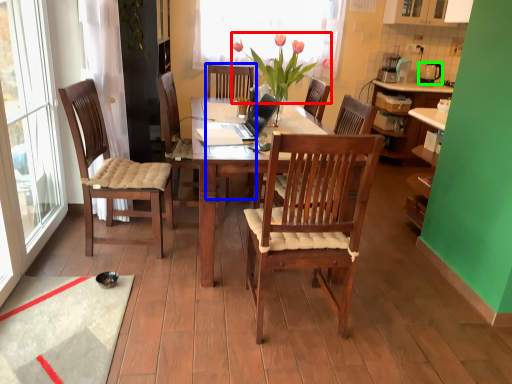
Question: Which object is positioned farthest from flower (highlighted by a red box)? Select from armchair (highlighted by a blue box) and loudspeaker (highlighted by a green box).

Choices:
 (A) armchair
 (B) loudspeaker

Answer: (B)